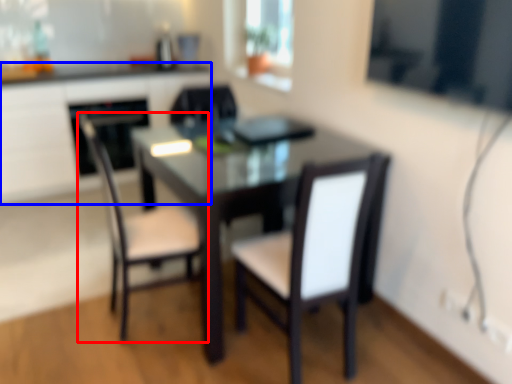
Question: Which of the following is the farthest to the observer, chair (highlighted by a red box) or computer desk (highlighted by a blue box)?

Choices:
 (A) chair
 (B) computer desk

Answer: (B)